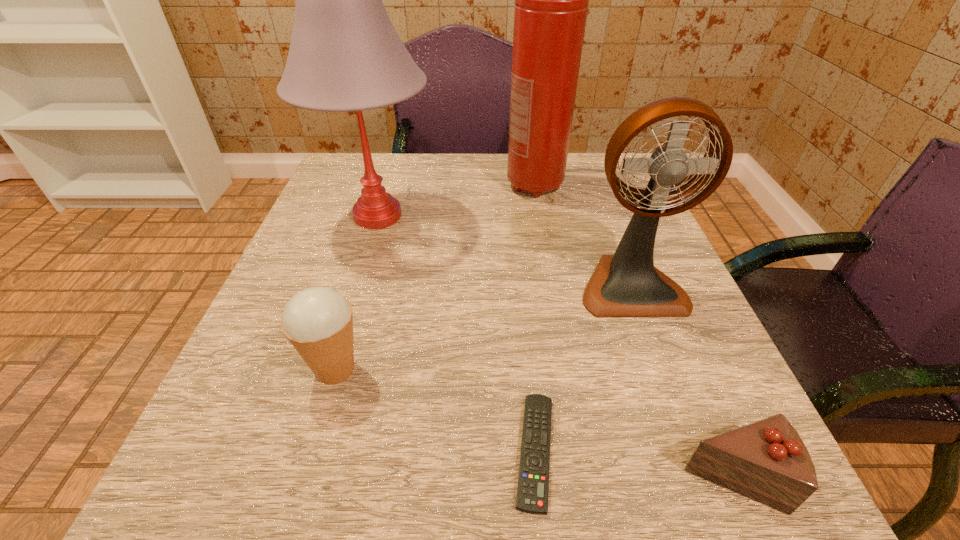
The image size is (960, 540). I want to click on free location that satisfies the following two spatial constraints: 1. on the front-facing side of the fan; 2. on the left side of the chocolate cake, so (701, 476).